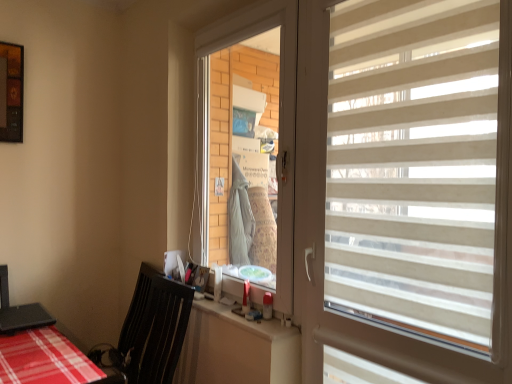
Question: In terms of width, does beige striped window blind at right look wider or thinner when compared to black plastic swivel chair at lower left?

Choices:
 (A) wide
 (B) thin

Answer: (B)

Question: Considering their positions, is beige striped window blind at right located in front of or behind black plastic swivel chair at lower left?

Choices:
 (A) behind
 (B) front

Answer: (B)

Question: Estimate the real-world distances between objects in this image. Which object is farther from the transparent plastic window screen at center?

Choices:
 (A) white plastic counter top at lower center
 (B) beige striped window blind at right
 (C) black plastic swivel chair at lower left

Answer: (C)

Question: Which object is the closest to the transparent plastic window screen at center?

Choices:
 (A) beige striped window blind at right
 (B) black plastic swivel chair at lower left
 (C) white plastic counter top at lower center

Answer: (A)